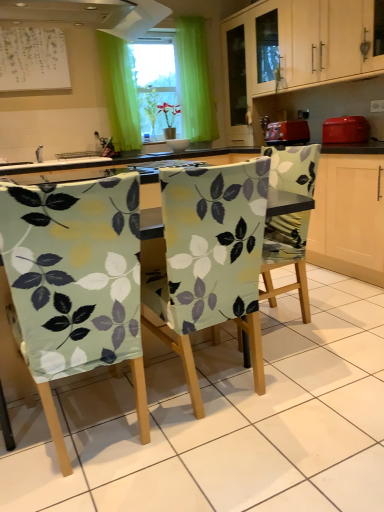
Question: From a real-world perspective, is white paper at upper left over matte red toaster at right, the first appliance when ordered from right to left?

Choices:
 (A) yes
 (B) no

Answer: (A)

Question: Does white paper at upper left appear on the left side of matte red toaster at right, arranged as the 2th appliance when viewed from the left?

Choices:
 (A) no
 (B) yes

Answer: (B)

Question: Is white paper at upper left bigger than matte red toaster at right, the first appliance when ordered from right to left?

Choices:
 (A) yes
 (B) no

Answer: (A)

Question: Can you confirm if white paper at upper left is positioned to the right of matte red toaster at right, arranged as the 2th appliance when viewed from the left?

Choices:
 (A) no
 (B) yes

Answer: (A)

Question: Is white paper at upper left not within matte red toaster at right, the first appliance when ordered from right to left?

Choices:
 (A) yes
 (B) no

Answer: (A)

Question: Is white paper at upper left taller than matte red toaster at right, the first appliance when ordered from right to left?

Choices:
 (A) no
 (B) yes

Answer: (B)

Question: Is white paper at upper left aimed at green fabric curtain at upper center?

Choices:
 (A) no
 (B) yes

Answer: (A)

Question: Considering the relative sizes of white paper at upper left and green fabric curtain at upper center in the image provided, is white paper at upper left wider than green fabric curtain at upper center?

Choices:
 (A) yes
 (B) no

Answer: (B)

Question: Is white paper at upper left turned away from green fabric curtain at upper center?

Choices:
 (A) no
 (B) yes

Answer: (A)

Question: Does white paper at upper left have a larger size compared to green fabric curtain at upper center?

Choices:
 (A) no
 (B) yes

Answer: (A)

Question: Is white paper at upper left shorter than green fabric curtain at upper center?

Choices:
 (A) yes
 (B) no

Answer: (A)

Question: Does white paper at upper left appear on the right side of green fabric curtain at upper center?

Choices:
 (A) no
 (B) yes

Answer: (A)

Question: Does light green fabric-covered chair at center, arranged as the 1th chair when viewed from the right, have a smaller size compared to light wood cabinet at upper center?

Choices:
 (A) no
 (B) yes

Answer: (B)